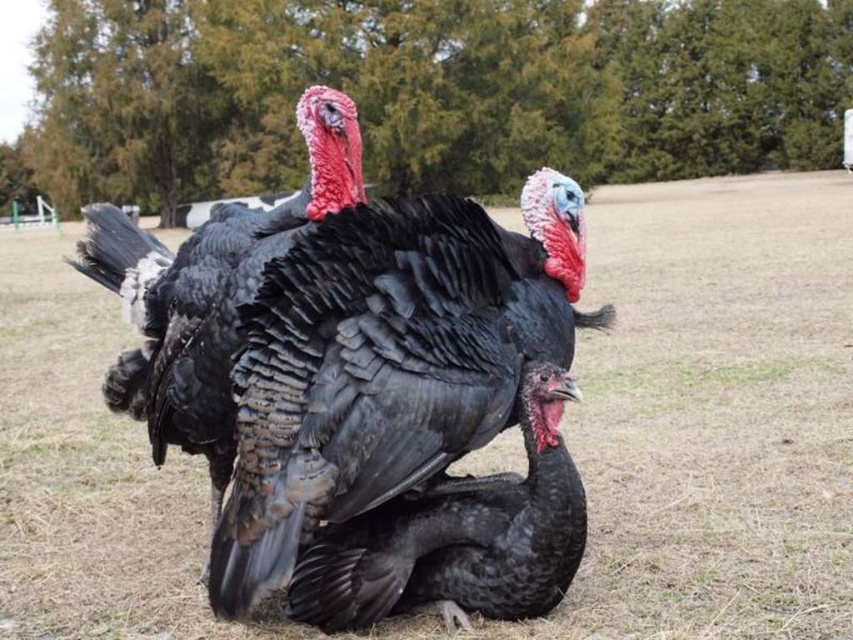
You are a photographer trying to capture the two turkeys in the center of the image. You want to ensure that the black matte turkey at center is positioned to the right of the shiny black turkey at center in your photo. Based on the scene description, will this arrangement be possible?

Yes, the arrangement is possible because the black matte turkey at center is already positioned to the right of the shiny black turkey at center in the scene.

You are a photographer trying to capture the black matte turkey at center and the shiny black turkey at center in a single shot. Which turkey is located below the other in the image?

The black matte turkey at center is positioned under the shiny black turkey at center, so the black matte turkey at center is located below the shiny black turkey at center in the image.